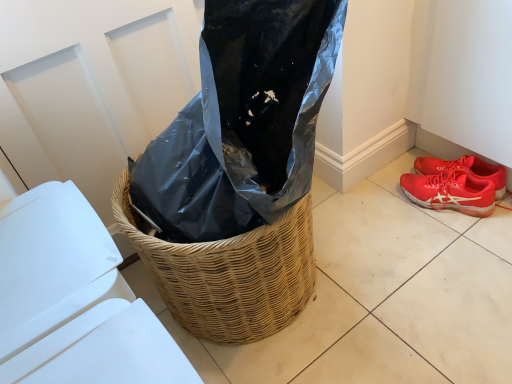
Identify the location of vacant area on top of white plastic lid at lower left (from a real-world perspective). This screenshot has height=384, width=512. (40, 253).